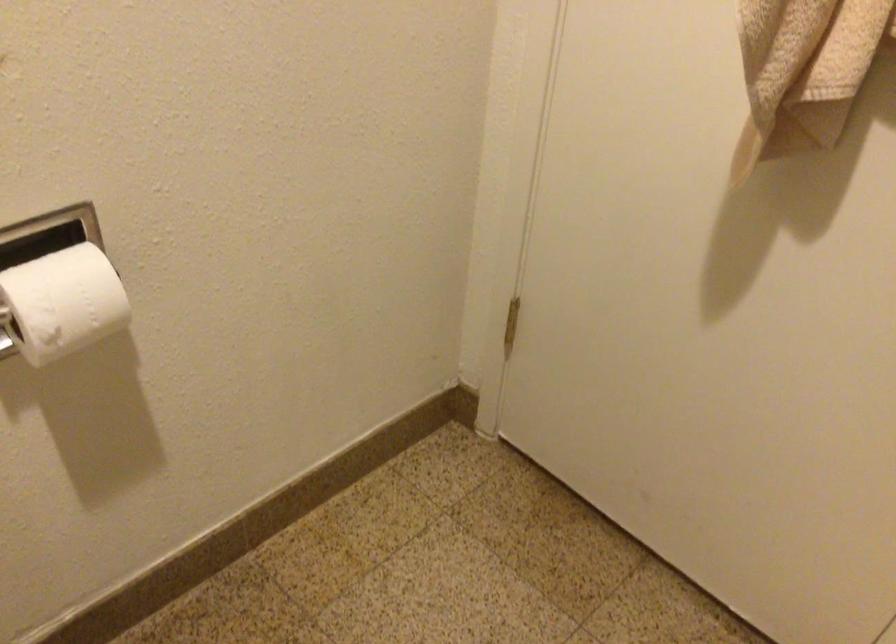
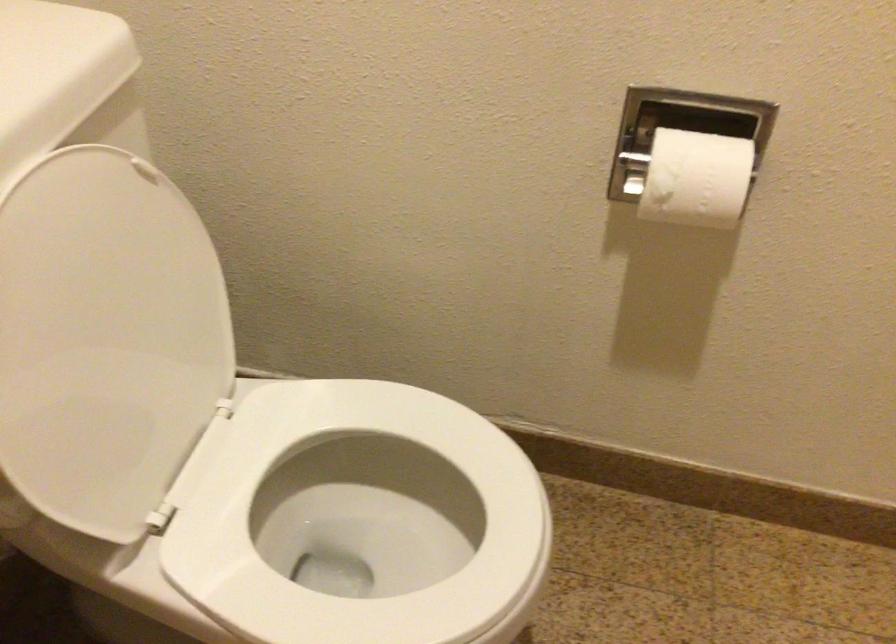
The point at [84,299] is marked in the first image. Where is the corresponding point in the second image?

(695, 178)